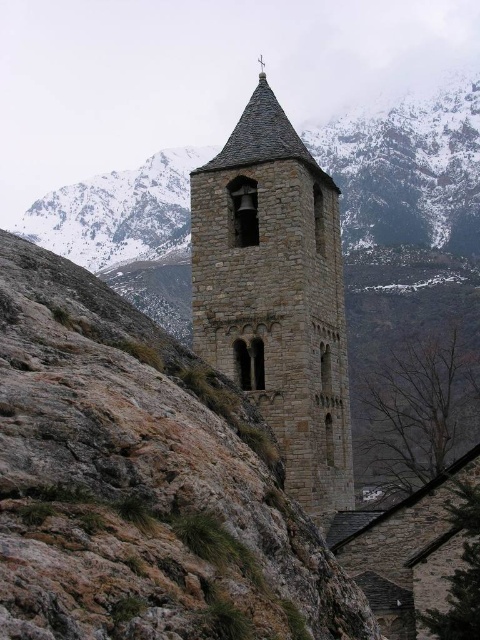
Question: Considering the relative positions of gray stone mountain at center and stone textured bell tower at center in the image provided, where is gray stone mountain at center located with respect to stone textured bell tower at center?

Choices:
 (A) below
 (B) above

Answer: (B)

Question: Which of the following is the closest to the observer?

Choices:
 (A) gray stone mountain at center
 (B) stone textured bell tower at center

Answer: (B)

Question: Can you confirm if gray stone mountain at center is positioned above stone textured bell tower at center?

Choices:
 (A) no
 (B) yes

Answer: (B)

Question: Which of the following is the farthest from the observer?

Choices:
 (A) (194, 150)
 (B) (288, 220)

Answer: (A)

Question: Is gray stone mountain at center smaller than stone textured bell tower at center?

Choices:
 (A) no
 (B) yes

Answer: (A)

Question: Which point is farther to the camera?

Choices:
 (A) (205, 323)
 (B) (420, 170)

Answer: (B)